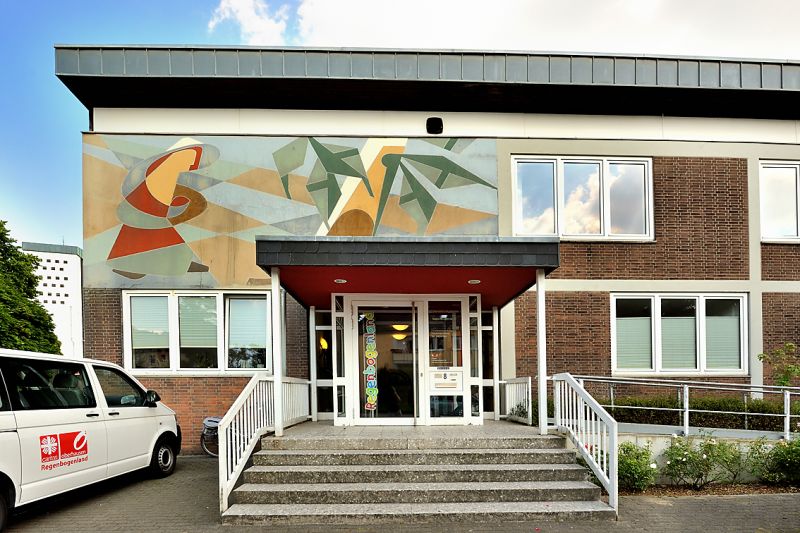
You are a GUI agent. You are given a task and a screenshot of the screen. Output one action in this format:
    pyautogui.click(x=<x>, y=<y>)
    Task: Click on the 2nd story window
    Image resolution: width=800 pixels, height=533 pixels.
    Given the screenshot: What is the action you would take?
    pyautogui.click(x=782, y=199), pyautogui.click(x=636, y=200), pyautogui.click(x=578, y=198), pyautogui.click(x=532, y=198)